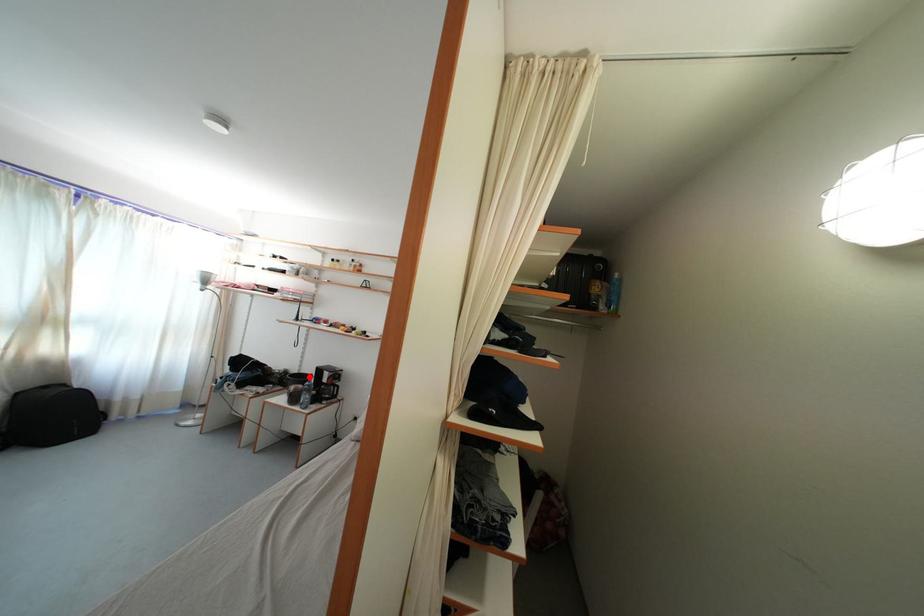
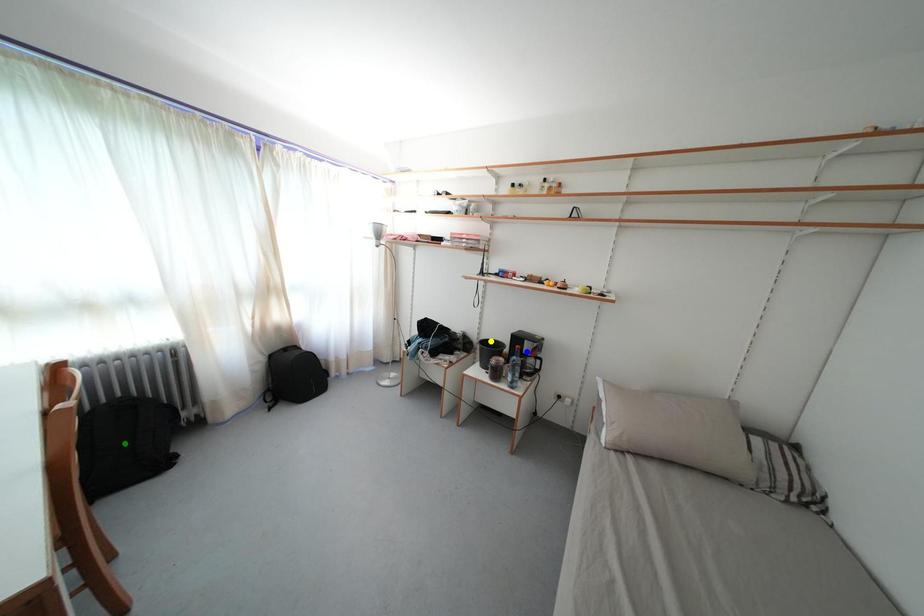
Question: I am providing you with two images of the same scene from different viewpoints. A red point is marked on the first image. You are given multiple points on the second image. Which spot in image 2 lines up with the point in image 1?

Choices:
 (A) blue point
 (B) yellow point
 (C) green point

Answer: (B)